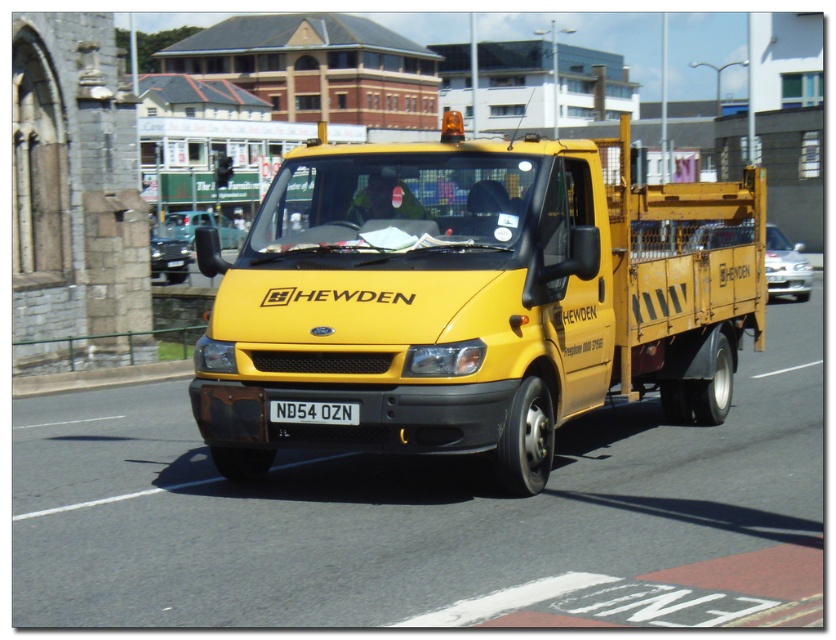
What are the coordinates of the yellow matte truck at center in the image?

The coordinates of the yellow matte truck at center are at point [473,300].

In the scene shown: You are standing in front of the HEWDEN utility truck and want to determine which point is closer to you. The points are labeled as point 1 at coordinates (711, 317) and point 2 at coordinates (281, 412). Which point is closer to your position?

Point 2 at coordinates (281, 412) is closer to you because it is less further to the camera than point 1 at coordinates (711, 317).

Looking at this image, you are a delivery driver who needs to park the yellow matte truck at center and the white plastic license plate at center in a narrow alley. The alley is only wide enough for one vehicle. Which vehicle should you park first to ensure both can fit?

The yellow matte truck at center is wider than the white plastic license plate at center, so you should park the yellow matte truck at center first to allow space for the narrower white plastic license plate at center afterward.